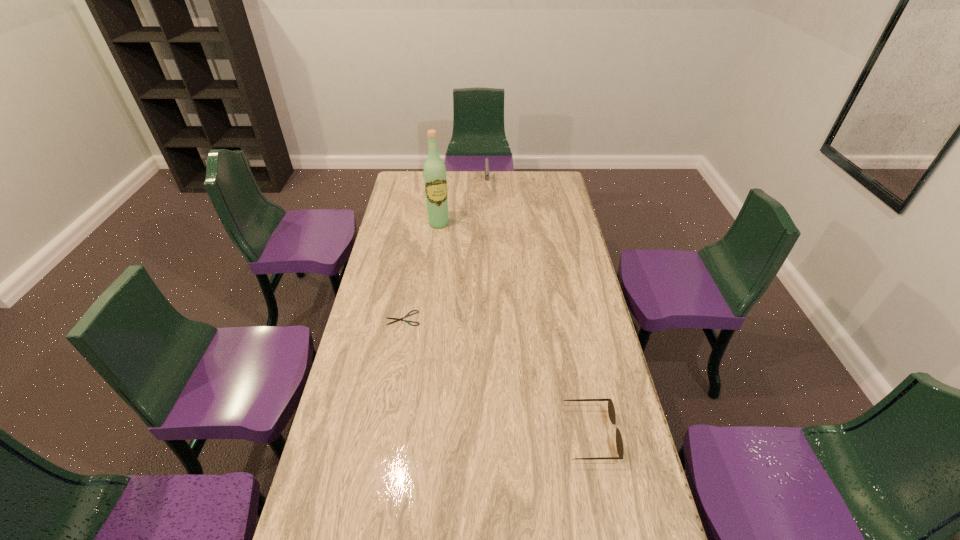
Locate an element on the screen. The image size is (960, 540). free space on the desktop that is between the shears and the rightmost object and is positioned on the front-facing side of the second farthest object is located at coordinates (503, 380).

What are the coordinates of `vacant space on the desktop that is between the second nearest object and the nearest object and is positioned at the barrel of the farthest object` in the screenshot? It's located at (494, 375).